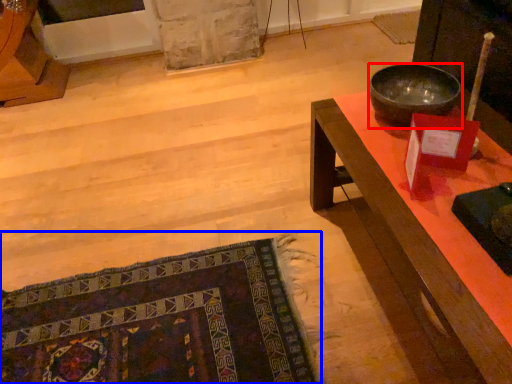
Question: Which of the following is the farthest to the observer, bowl (highlighted by a red box) or mat (highlighted by a blue box)?

Choices:
 (A) bowl
 (B) mat

Answer: (A)